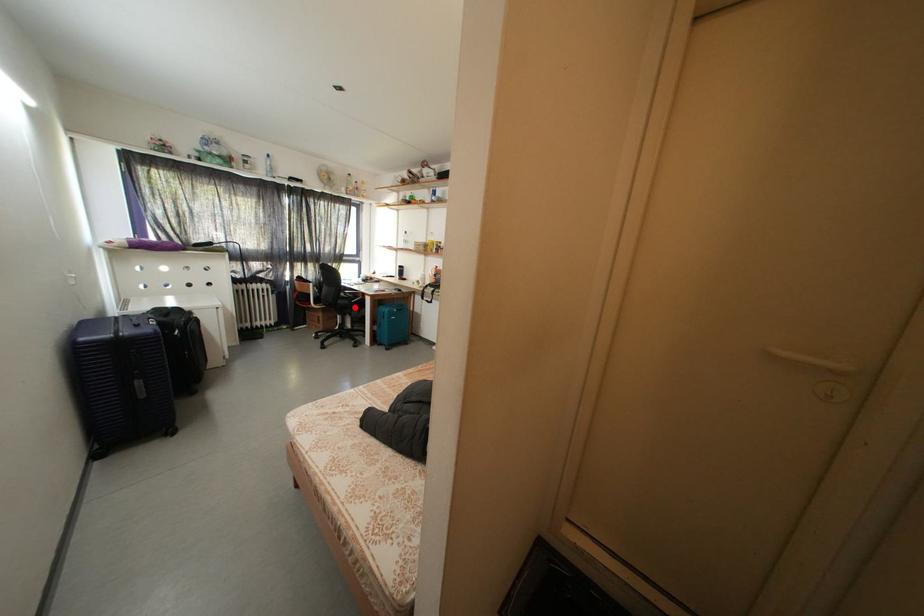
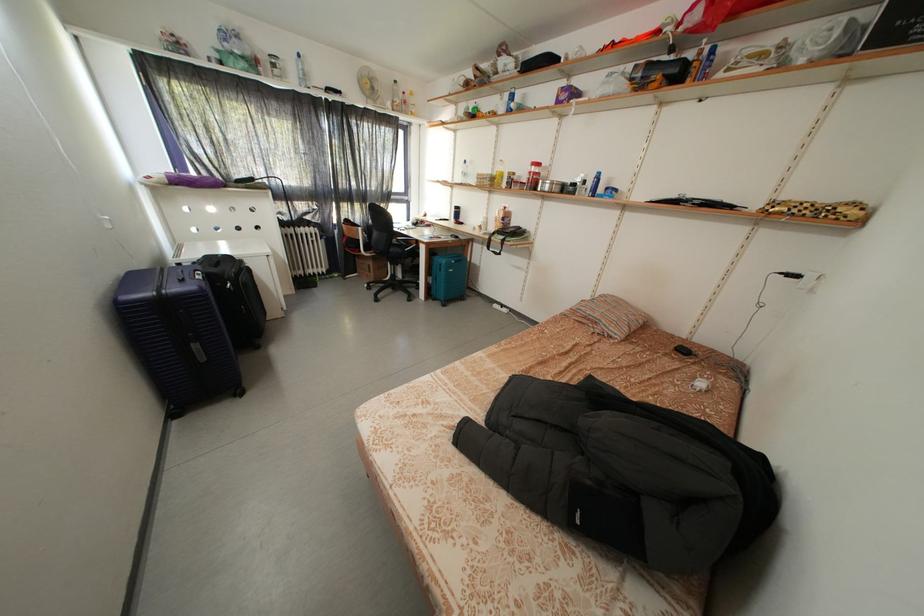
Locate, in the second image, the point that corresponds to the highlighted location in the first image.

(407, 256)